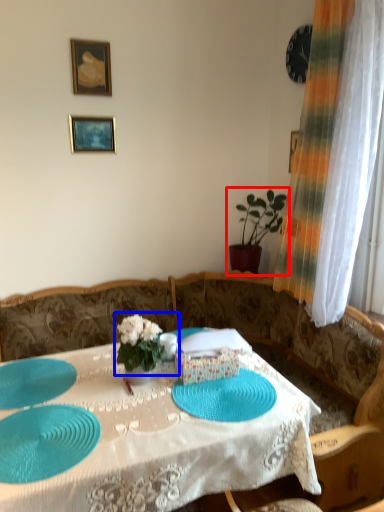
Question: Among these objects, which one is nearest to the camera, houseplant (highlighted by a red box) or floral arrangement (highlighted by a blue box)?

Choices:
 (A) houseplant
 (B) floral arrangement

Answer: (B)